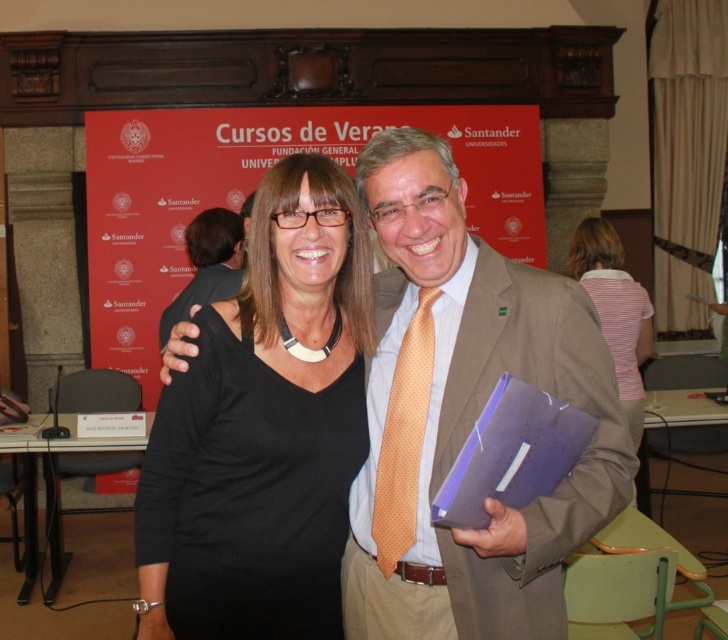
Is point (534, 349) positioned after point (620, 323)?

No, (534, 349) is closer to viewer.

The height and width of the screenshot is (640, 728). In order to click on matte brown suit at center in this screenshot , I will do `click(464, 416)`.

Identify the location of matte brown suit at center. (464, 416).

Is black matte shirt at center to the left of striped fabric shirt at center from the viewer's perspective?

Yes, black matte shirt at center is to the left of striped fabric shirt at center.

Who is higher up, black matte shirt at center or striped fabric shirt at center?

Positioned higher is striped fabric shirt at center.

Image resolution: width=728 pixels, height=640 pixels. Identify the location of black matte shirt at center. (264, 429).

Where is `black matte shirt at center`? black matte shirt at center is located at coordinates coord(264,429).

Does matte brown suit at center have a smaller size compared to black matte shirt at center?

No.

Does point (502, 620) come in front of point (349, 227)?

Yes, it is.

Which is behind, point (368, 534) or point (199, 570)?

The point (368, 534) is behind.

You are a GUI agent. You are given a task and a screenshot of the screen. Output one action in this format:
    pyautogui.click(x=<x>, y=<y>)
    Task: Click on the matte brown suit at center
    
    Given the screenshot: What is the action you would take?
    (x=464, y=416)